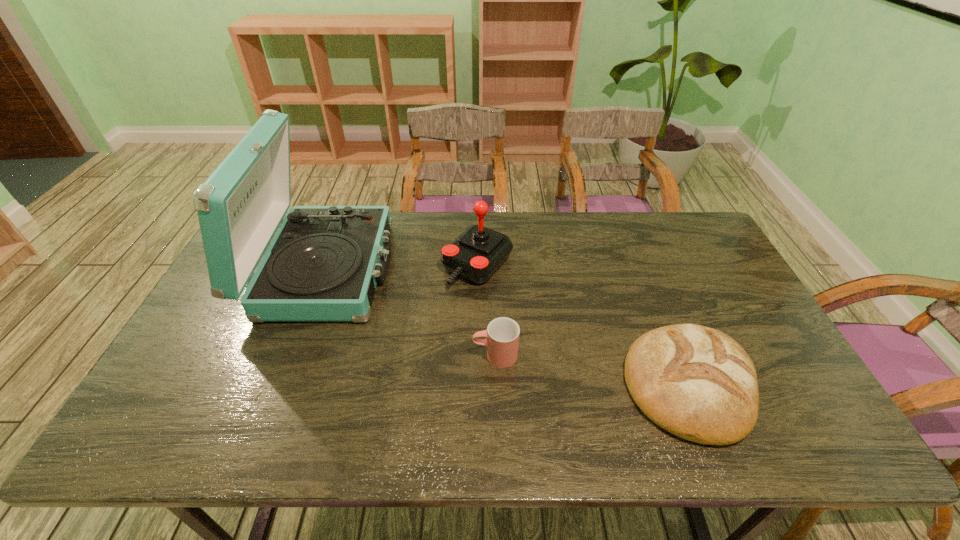
Locate an element on the screen. The width and height of the screenshot is (960, 540). free space between the joystick and the leftmost object is located at coordinates (400, 267).

Identify the location of empty location between the cup and the rightmost object. The height and width of the screenshot is (540, 960). (592, 370).

Locate an element on the screen. Image resolution: width=960 pixels, height=540 pixels. object that stands as the second closest to the joystick is located at coordinates (502, 335).

Identify which object is located as the nearest to the bread. Please provide its 2D coordinates. Your answer should be formatted as a tuple, i.e. [(x, y)], where the tuple contains the x and y coordinates of a point satisfying the conditions above.

[(502, 335)]

Locate an element on the screen. The width and height of the screenshot is (960, 540). free spot that satisfies the following two spatial constraints: 1. on the side of the cup with the handle; 2. on the face side of the tallest object is located at coordinates (492, 269).

Find the location of a particular element. free spot that satisfies the following two spatial constraints: 1. on the face side of the leftmost object; 2. on the side of the cup with the handle is located at coordinates (291, 355).

This screenshot has height=540, width=960. I want to click on vacant space that satisfies the following two spatial constraints: 1. on the face side of the rightmost object; 2. on the left side of the record player, so click(x=279, y=385).

Locate an element on the screen. vacant position in the image that satisfies the following two spatial constraints: 1. on the face side of the leftmost object; 2. on the side of the cup with the handle is located at coordinates (291, 355).

At what (x,y) coordinates should I click in order to perform the action: click on free location that satisfies the following two spatial constraints: 1. on the face side of the tallest object; 2. on the left side of the bread. Please return your answer as a coordinate pair (x, y). Looking at the image, I should click on (279, 385).

Where is `free spot that satisfies the following two spatial constraints: 1. on the front side of the joystick; 2. on the face side of the tallest object`? The image size is (960, 540). free spot that satisfies the following two spatial constraints: 1. on the front side of the joystick; 2. on the face side of the tallest object is located at coordinates (477, 269).